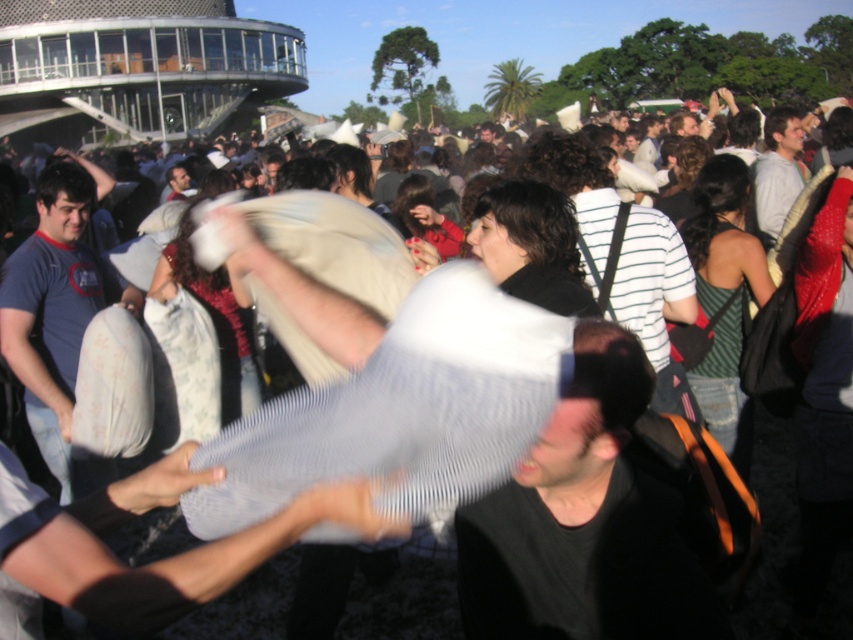
You are a photographer trying to capture a clear shot of both the dark gray shirt at center and the matte white pillow at left in the same frame. Given that your camera has a minimum focus distance of 30 meters, will you be able to achieve this shot?

The dark gray shirt at center and the matte white pillow at left are 34.22 meters apart, so yes, you can capture both in the same frame since the distance between them is greater than the camera minimum focus distance of 30 meters.

You are a photographer trying to capture a clear shot of the dark gray shirt at center and the matte white pillow at left. Based on their heights, which one will be easier to see from above?

The matte white pillow at left is taller than the dark gray shirt at center, so it will be easier to see from above.

You are a photographer trying to capture a clear shot of the dark gray shirt at center and the matte white pillow at left. Based on their positions, which object is closer to the camera?

The dark gray shirt at center is positioned under the matte white pillow at left, meaning the matte white pillow at left is closer to the camera.